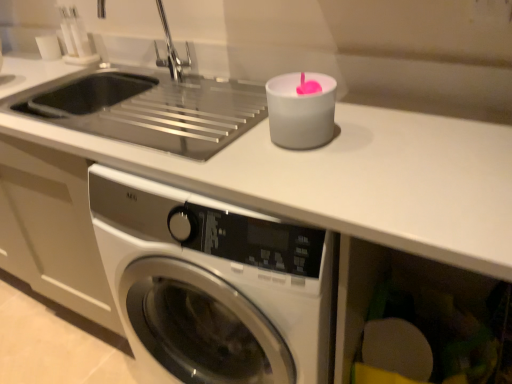
In order to click on free spot in front of white matte candle at upper right in this screenshot , I will do `click(300, 170)`.